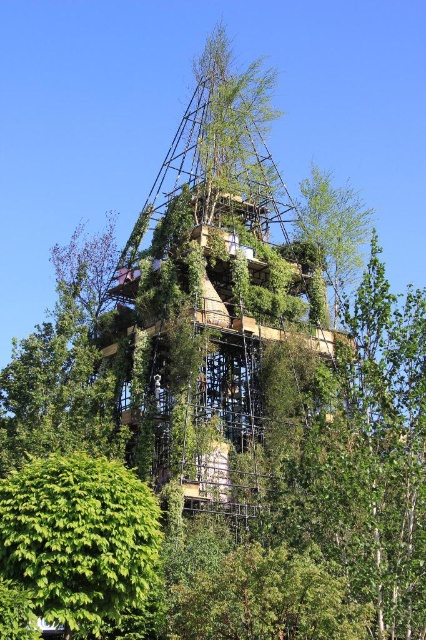
Question: From the image, what is the correct spatial relationship of green leafy bush at lower left in relation to green leafy tree at lower center?

Choices:
 (A) above
 (B) below

Answer: (A)

Question: Which point is closer to the camera taking this photo?

Choices:
 (A) [x=273, y=614]
 (B) [x=66, y=509]

Answer: (B)

Question: Which of the following is the closest to the observer?

Choices:
 (A) (43, 618)
 (B) (354, 612)

Answer: (A)

Question: Is the position of green leafy bush at lower left less distant than that of green leafy tree at lower center?

Choices:
 (A) no
 (B) yes

Answer: (B)

Question: Is green leafy bush at lower left thinner than green leafy tree at lower center?

Choices:
 (A) no
 (B) yes

Answer: (B)